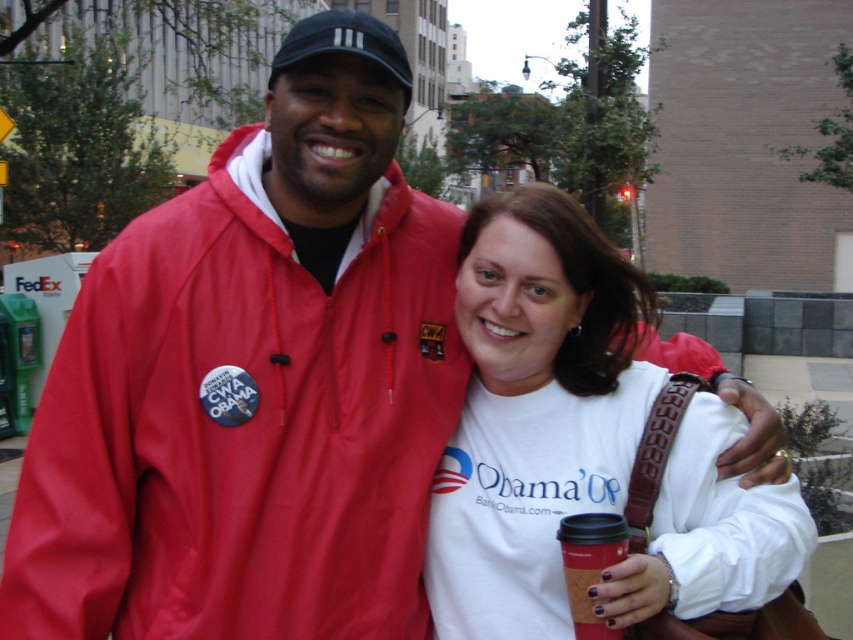
Find the location of `white matte t-shirt at center`. white matte t-shirt at center is located at coordinates (534, 410).

Can you confirm if white matte t-shirt at center is positioned below red paper cup at lower center?

No, white matte t-shirt at center is not below red paper cup at lower center.

The image size is (853, 640). Identify the location of white matte t-shirt at center. (534, 410).

Is matte red jacket at center wider than white matte t-shirt at center?

Correct, the width of matte red jacket at center exceeds that of white matte t-shirt at center.

Who is more forward, (349, 512) or (643, 301)?

Positioned in front is point (349, 512).

The height and width of the screenshot is (640, 853). In order to click on matte red jacket at center in this screenshot , I will do `click(241, 428)`.

Does matte red jacket at center have a greater width compared to red paper cup at lower center?

Yes.

Is matte red jacket at center closer to the viewer compared to red paper cup at lower center?

No, matte red jacket at center is further to the viewer.

Is point (428, 444) positioned after point (622, 536)?

Yes, point (428, 444) is farther from viewer.

This screenshot has width=853, height=640. Find the location of `matte red jacket at center`. matte red jacket at center is located at coordinates (241, 428).